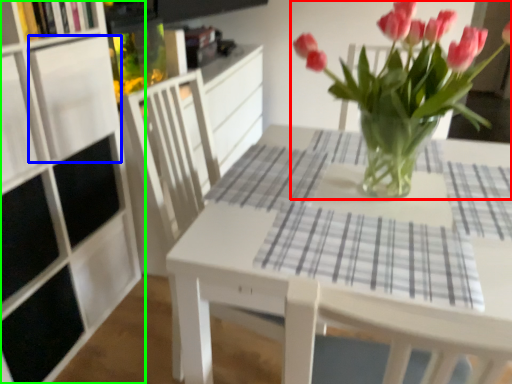
Question: Which object is positioned closest to houseplant (highlighted by a red box)? Select from shelf (highlighted by a blue box) and cabinetry (highlighted by a green box).

Choices:
 (A) shelf
 (B) cabinetry

Answer: (A)